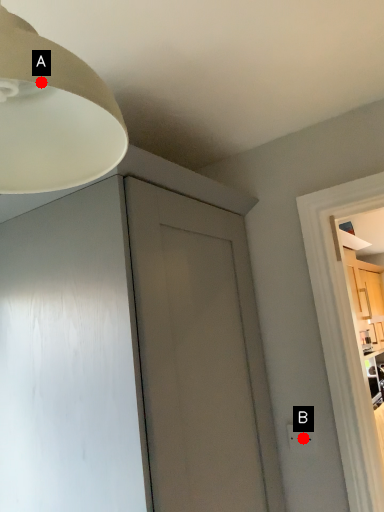
Question: Two points are circled on the image, labeled by A and B beside each circle. Which point is closer to the camera taking this photo?

Choices:
 (A) A is closer
 (B) B is closer

Answer: (A)